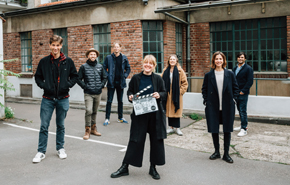
At what (x,y) coordinates should I click in order to perform the action: click on cold air return. Please return your answer as a coordinate pair (x, y). Looking at the image, I should click on (25, 88).